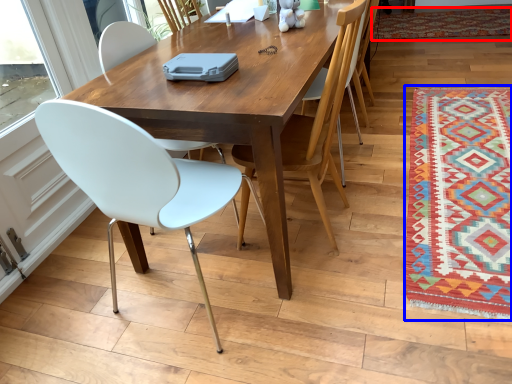
Question: Among these objects, which one is farthest to the camera, mat (highlighted by a red box) or mat (highlighted by a blue box)?

Choices:
 (A) mat
 (B) mat

Answer: (A)